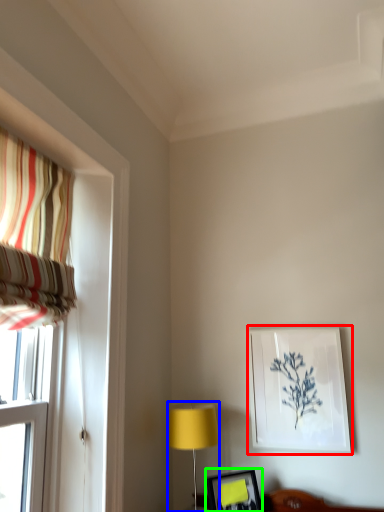
Question: Which object is positioned farthest from picture frame (highlighted by a red box)? Select from table lamp (highlighted by a blue box) and picture frame (highlighted by a green box).

Choices:
 (A) table lamp
 (B) picture frame

Answer: (A)